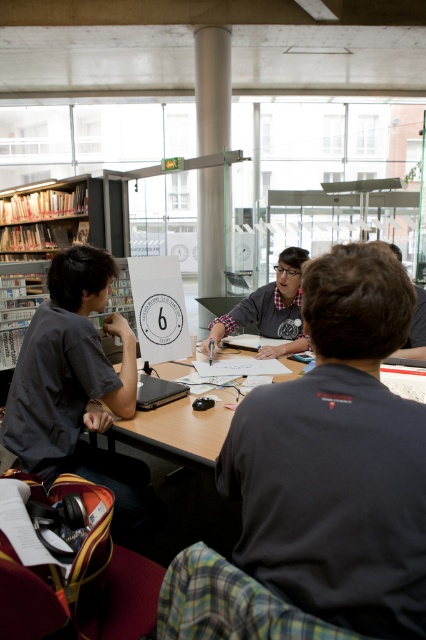
You are a photographer positioned to the left of the scene. You want to capture a photo of the matte gray shirt at center and the matte black laptop at center without any obstructions. Based on their positions, which object should you adjust your angle to prioritize capturing first?

The matte gray shirt at center is to the right of the matte black laptop at center. Since you are positioned to the left of the scene, the matte black laptop at center is closer to your position. Adjust your angle to prioritize capturing the matte black laptop at center first to avoid obstructions from the matte gray shirt at center.

Looking at the scene, there are two people at the center wearing dark gray shirt at center and matte gray shirt at center. Which one is positioned to the left?

The dark gray shirt at center is to the left of the matte gray shirt at center.

You are standing at point (273,317) and want to walk to the exit located at point (382,250). Is the exit directly behind you or in front of you?

The exit at point (382,250) is in front of you because it is located in front of your current position at point (273,317).